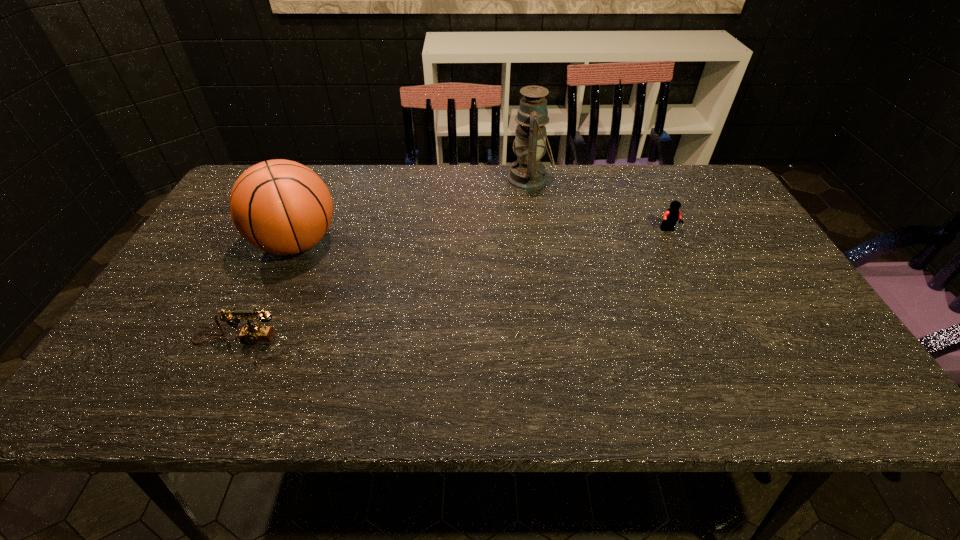
Where is `free spot between the third shortest object and the tallest object`? free spot between the third shortest object and the tallest object is located at coordinates (413, 212).

This screenshot has width=960, height=540. Identify the location of empty space that is in between the Lego and the farthest object. (599, 205).

Find the location of `free space between the third shortest object and the nearest object`. free space between the third shortest object and the nearest object is located at coordinates (267, 291).

Locate an element on the screen. The height and width of the screenshot is (540, 960). free spot between the nearest object and the basketball is located at coordinates (267, 291).

At what (x,y) coordinates should I click in order to perform the action: click on vacant space in between the nearest object and the Lego. Please return your answer as a coordinate pair (x, y). The width and height of the screenshot is (960, 540). Looking at the image, I should click on (452, 285).

Locate an element on the screen. The width and height of the screenshot is (960, 540). object that can be found as the closest to the second tallest object is located at coordinates point(251,333).

Identify the location of the closest object to the nearest object. (279, 206).